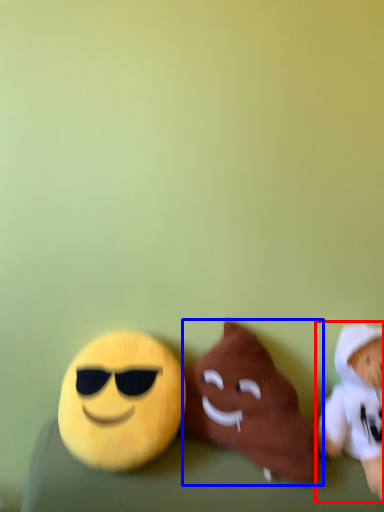
Question: Among these objects, which one is nearest to the camera, toy (highlighted by a red box) or toy (highlighted by a blue box)?

Choices:
 (A) toy
 (B) toy

Answer: (A)